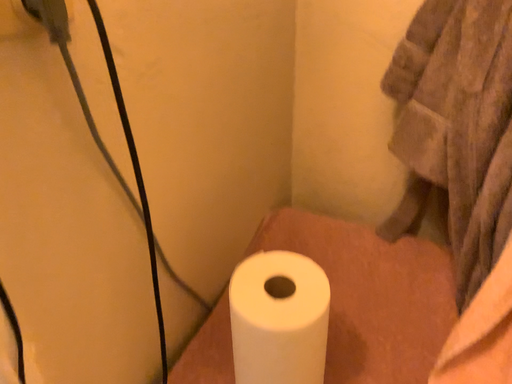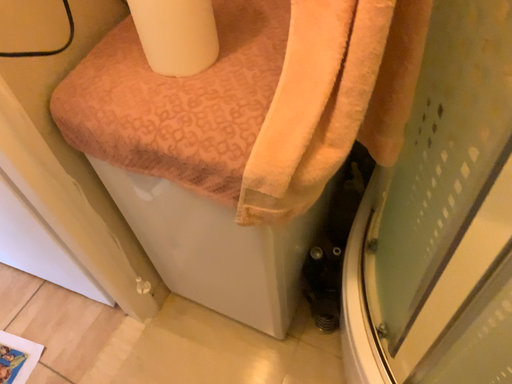
Question: How did the camera likely rotate when shooting the video?

Choices:
 (A) rotated downward
 (B) rotated upward

Answer: (A)